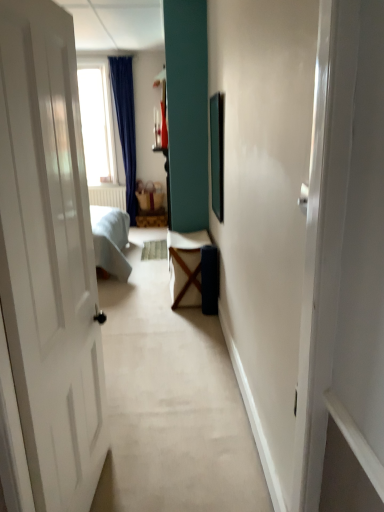
Question: Is matte brown basket at center wider than metallic silver picture frame at center?

Choices:
 (A) yes
 (B) no

Answer: (A)

Question: Is matte brown basket at center not near metallic silver picture frame at center?

Choices:
 (A) no
 (B) yes

Answer: (B)

Question: From a real-world perspective, is matte brown basket at center positioned over metallic silver picture frame at center based on gravity?

Choices:
 (A) yes
 (B) no

Answer: (B)

Question: From the image's perspective, is matte brown basket at center under metallic silver picture frame at center?

Choices:
 (A) no
 (B) yes

Answer: (A)

Question: Could you tell me if matte brown basket at center is facing metallic silver picture frame at center?

Choices:
 (A) yes
 (B) no

Answer: (A)

Question: Does matte brown basket at center appear on the right side of metallic silver picture frame at center?

Choices:
 (A) yes
 (B) no

Answer: (B)

Question: Can you confirm if white fabric table at center is bigger than metallic silver picture frame at center?

Choices:
 (A) no
 (B) yes

Answer: (B)

Question: Is white fabric table at center oriented away from metallic silver picture frame at center?

Choices:
 (A) yes
 (B) no

Answer: (B)

Question: From the image's perspective, is white fabric table at center located beneath metallic silver picture frame at center?

Choices:
 (A) no
 (B) yes

Answer: (B)

Question: Does white fabric table at center turn towards metallic silver picture frame at center?

Choices:
 (A) yes
 (B) no

Answer: (B)

Question: Can you confirm if white fabric table at center is wider than metallic silver picture frame at center?

Choices:
 (A) yes
 (B) no

Answer: (A)

Question: Is white fabric table at center shorter than metallic silver picture frame at center?

Choices:
 (A) yes
 (B) no

Answer: (A)

Question: Considering the relative positions of matte brown basket at center and white fabric table at center in the image provided, is matte brown basket at center to the right of white fabric table at center from the viewer's perspective?

Choices:
 (A) no
 (B) yes

Answer: (A)